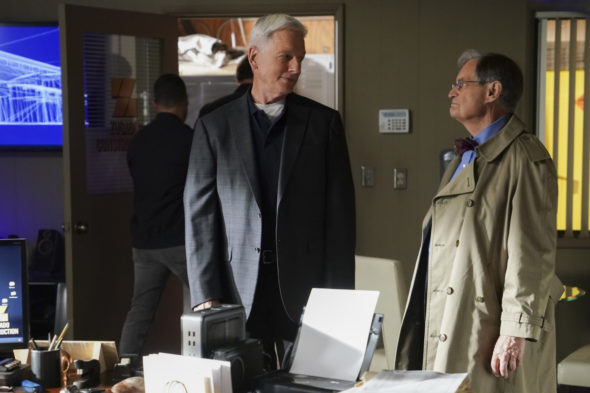
Find the location of `piece of paper`. piece of paper is located at coordinates (316, 303).